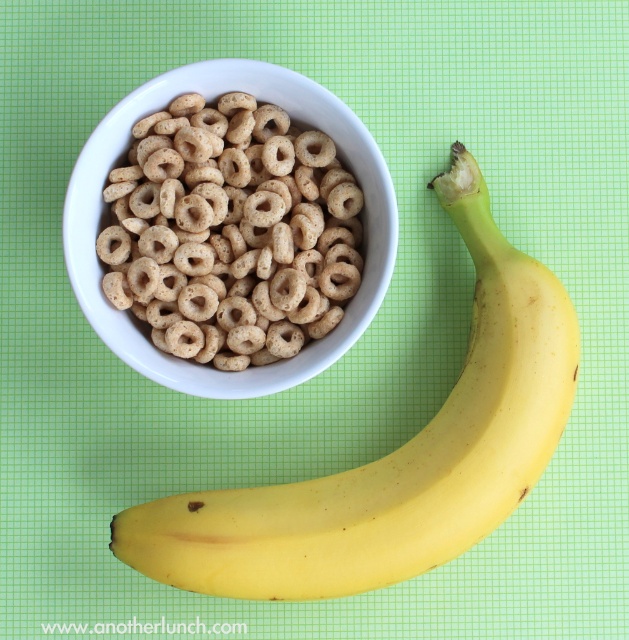
This screenshot has height=640, width=629. Describe the element at coordinates (394, 452) in the screenshot. I see `yellow smooth banana at lower right` at that location.

Is point (211, 554) closer to camera compared to point (147, 198)?

Yes.

Find the location of `yellow smooth banana at lower right`. yellow smooth banana at lower right is located at coordinates (394, 452).